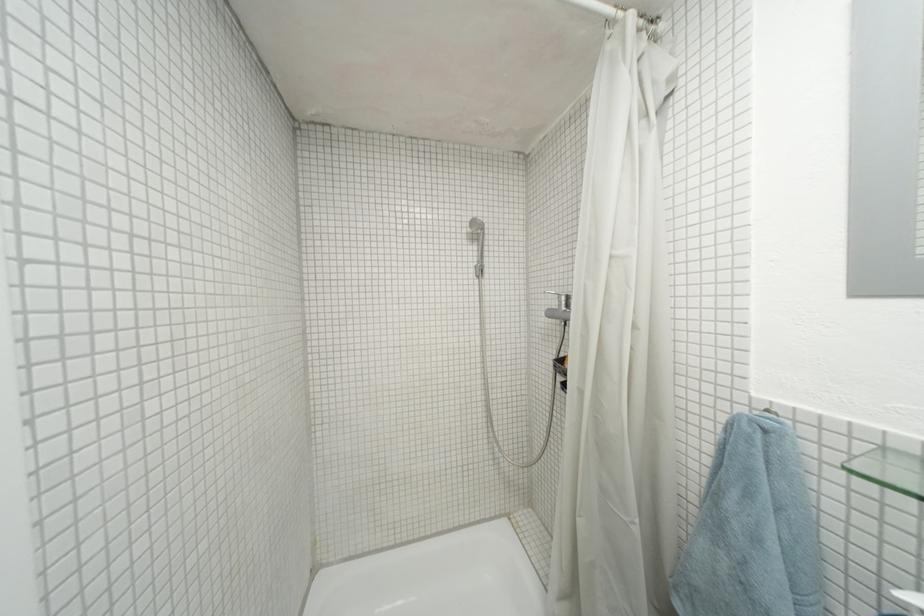
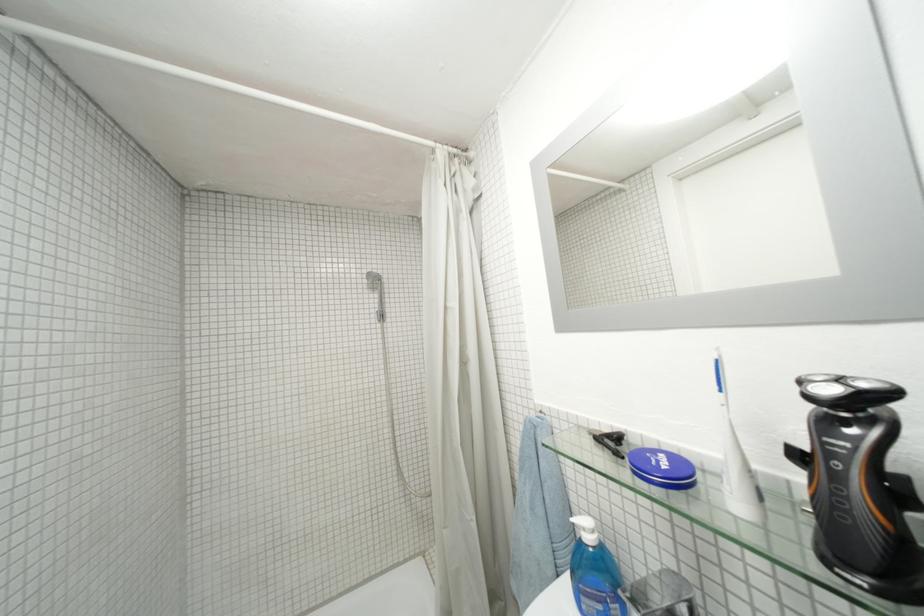
The point at (x=473, y=267) is marked in the first image. Where is the corresponding point in the second image?

(375, 314)